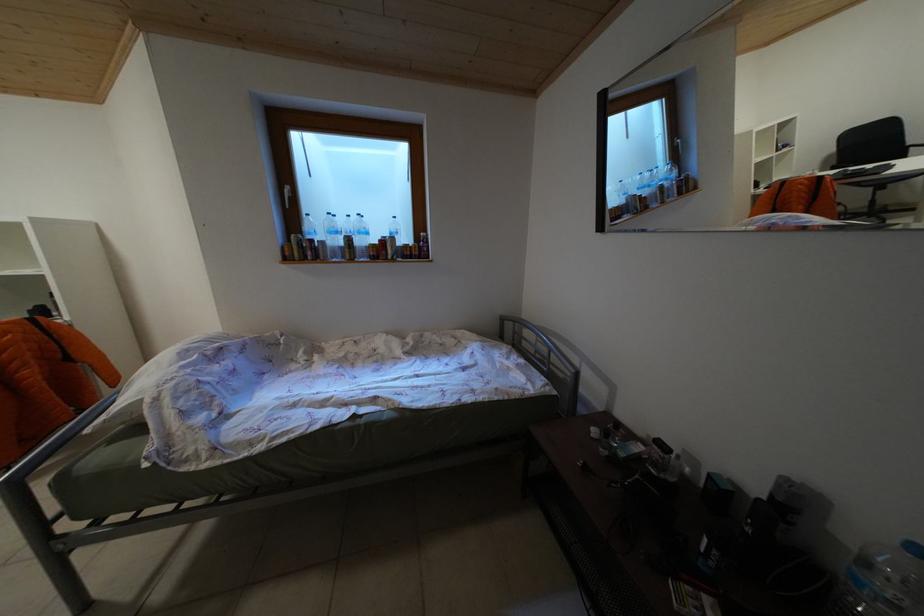
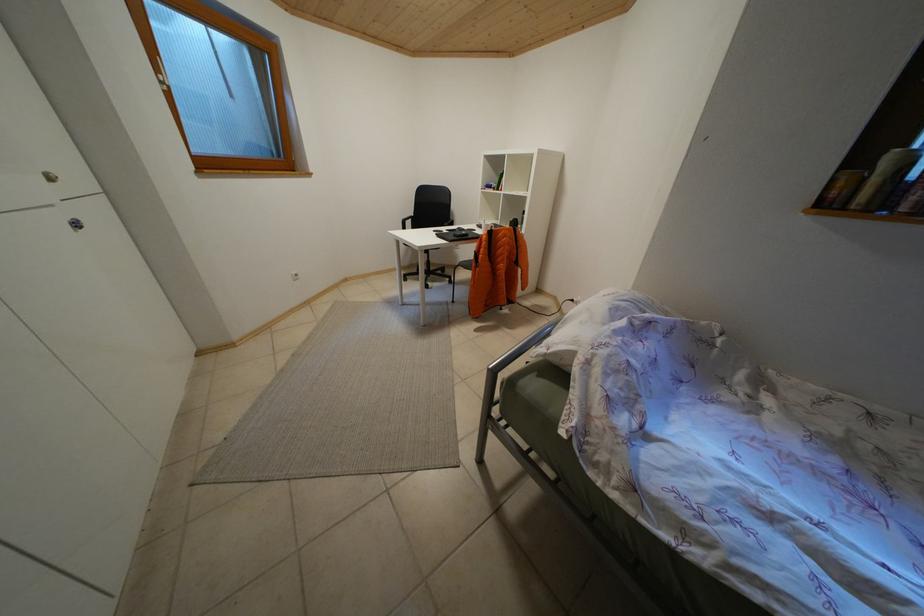
The images are taken continuously from a first-person perspective. In which direction is your viewpoint rotating?

The camera's rotation is toward left-down.